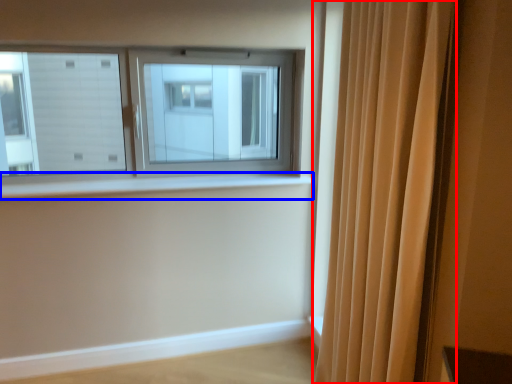
Question: Which of the following is the farthest to the observer, curtain (highlighted by a red box) or window sill (highlighted by a blue box)?

Choices:
 (A) curtain
 (B) window sill

Answer: (B)